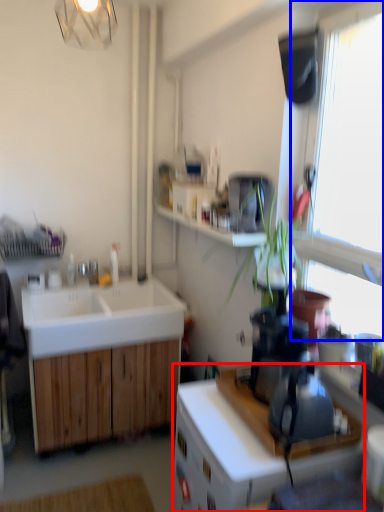
Question: Which of the following is the farthest to the observer, cabinetry (highlighted by a red box) or window (highlighted by a blue box)?

Choices:
 (A) cabinetry
 (B) window

Answer: (A)